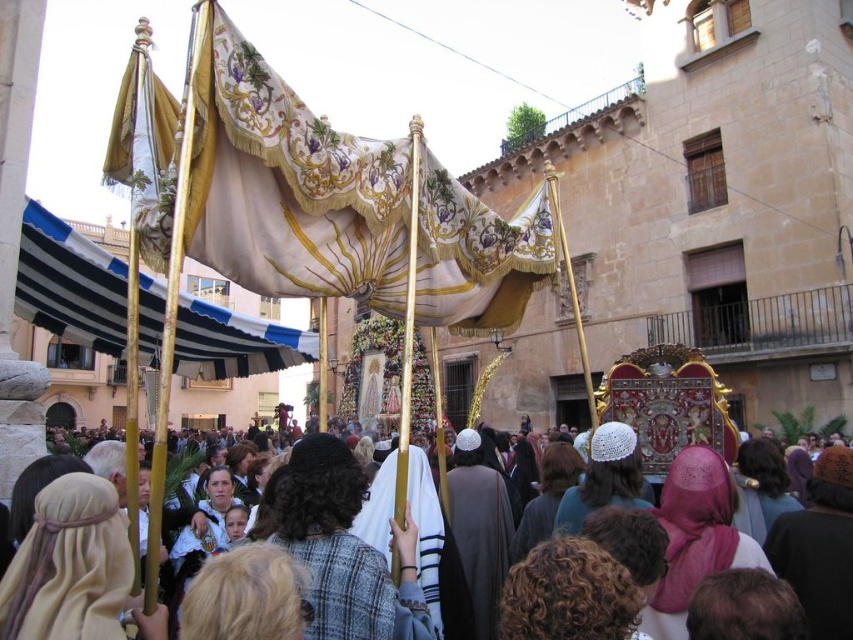
Question: Among these objects, which one is nearest to the camera?

Choices:
 (A) white woolen shawl at center
 (B) blue and white striped fabric at left
 (C) gold embroidered flag at upper left

Answer: (A)

Question: Observing the image, what is the correct spatial positioning of blue and white striped fabric at left in reference to dark gray woolen robe at center?

Choices:
 (A) above
 (B) below

Answer: (A)

Question: Is gold embroidered canopy at center below blue and white striped fabric at left?

Choices:
 (A) yes
 (B) no

Answer: (B)

Question: Is blue and white striped fabric at left thinner than white woolen shawl at center?

Choices:
 (A) yes
 (B) no

Answer: (A)

Question: Which point is closer to the camera?

Choices:
 (A) (502, 278)
 (B) (480, 465)
 (C) (184, 300)

Answer: (A)

Question: Which object is farther from the camera taking this photo?

Choices:
 (A) dark gray woolen robe at center
 (B) blue and white striped fabric at left

Answer: (A)